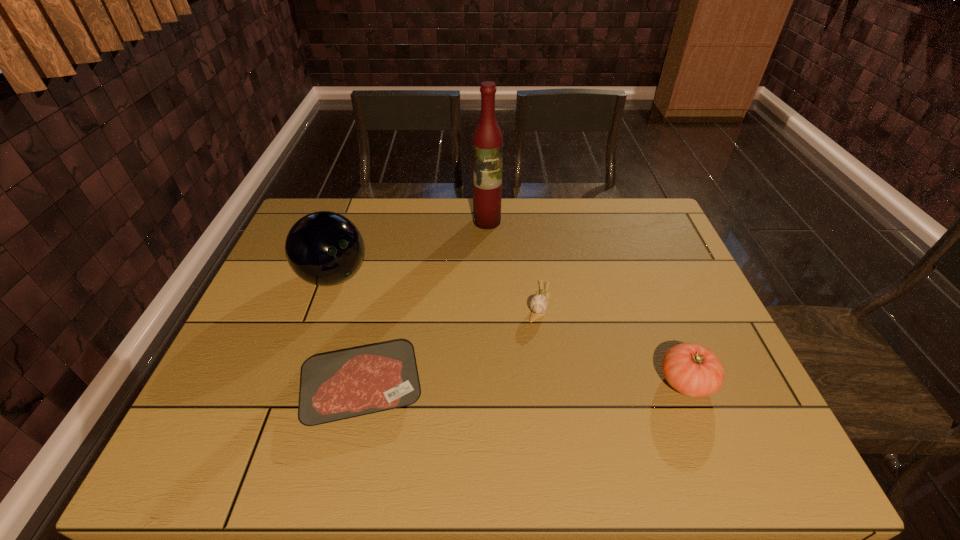
The height and width of the screenshot is (540, 960). I want to click on free region located on the shell of the fourth tallest object, so click(x=528, y=367).

Where is `free point located 0.240m on the shell of the fourth tallest object`? free point located 0.240m on the shell of the fourth tallest object is located at coordinates (519, 403).

Locate an element on the screen. The image size is (960, 540). vacant space located 0.050m on the shell of the fourth tallest object is located at coordinates click(x=535, y=338).

This screenshot has width=960, height=540. Identify the location of free location located on the side of the bowling ball with the finger holes. (421, 328).

I want to click on free spot located on the side of the bowling ball with the finger holes, so (440, 339).

I want to click on free space located 0.090m on the side of the bowling ball with the finger holes, so click(x=382, y=305).

You are a GUI agent. You are given a task and a screenshot of the screen. Output one action in this format:
    pyautogui.click(x=<x>, y=<y>)
    Task: Click on the vacant space located on the label of the farthest object
    This screenshot has width=960, height=540.
    Given the screenshot: What is the action you would take?
    pyautogui.click(x=486, y=286)

This screenshot has width=960, height=540. Identify the location of blank area located 0.090m on the label of the farthest object. (487, 247).

Find the location of `vacant region located 0.060m on the label of the farthest object`. vacant region located 0.060m on the label of the farthest object is located at coordinates (487, 241).

Where is `object at the far edge`? The height and width of the screenshot is (540, 960). object at the far edge is located at coordinates (487, 143).